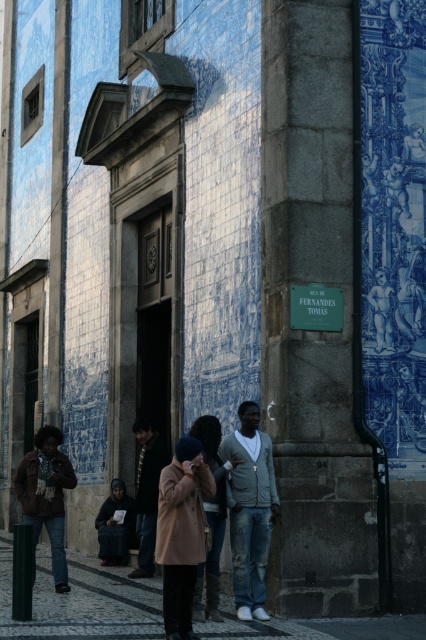
Question: Which object is closer to the camera taking this photo?

Choices:
 (A) denim jeans at center
 (B) beige wool coat at center
 (C) brown woolen coat at center

Answer: (B)

Question: Can you confirm if brown leather jacket at lower left is positioned to the right of dark brown leather jacket at center?

Choices:
 (A) no
 (B) yes

Answer: (A)

Question: Is dark gray concrete sidewalk at lower center bigger than blue glazed tile at upper right?

Choices:
 (A) no
 (B) yes

Answer: (B)

Question: Observing the image, what is the correct spatial positioning of brown woolen coat at center in reference to dark brown leather jacket at center?

Choices:
 (A) left
 (B) right

Answer: (B)

Question: Among these points, which one is farthest from the camera?

Choices:
 (A) (51, 477)
 (B) (198, 444)
 (C) (143, 480)

Answer: (C)

Question: Which object appears closest to the camera in this image?

Choices:
 (A) dark brown leather jacket at lower center
 (B) blue glazed tile at upper right

Answer: (B)